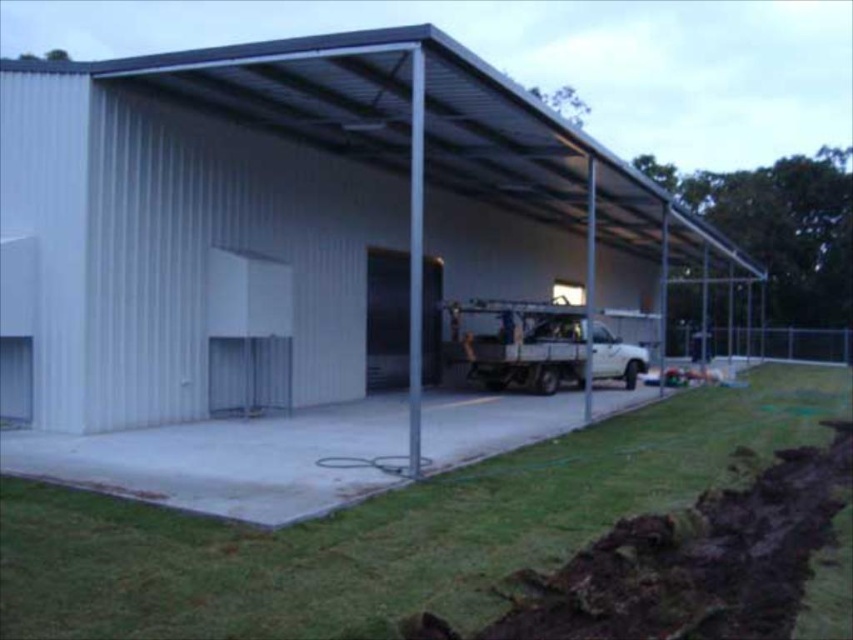
You are standing at the entrance of the industrial building and want to walk to the garage door. There are two points marked on the floor, point (344, 145) and point (372, 282). Which point should you step on first if you are moving towards the garage door?

You should step on point (344, 145) first because it is in front of point (372, 282) when moving towards the garage door.

Looking at this image, you are a delivery person arriving at the industrial building and need to park your vehicle. The white matte truck at center is already parked near the satin silver door at center. Where should you park your vehicle to avoid blocking the entrance?

You should park your vehicle to the left side of the satin silver door at center since the white matte truck at center is on the right side of it, leaving the left side open for the entrance.

You are a delivery person who needs to park your truck in the garage. The garage has a specific parking spot marked at point (538, 346). Where should you position your truck relative to the existing white pickup truck at center?

You should position your truck at the parking spot marked at point (538, 346), which is where the white matte truck at center is currently located. However, since the existing truck is already parked there, you may need to wait or find an alternative spot.